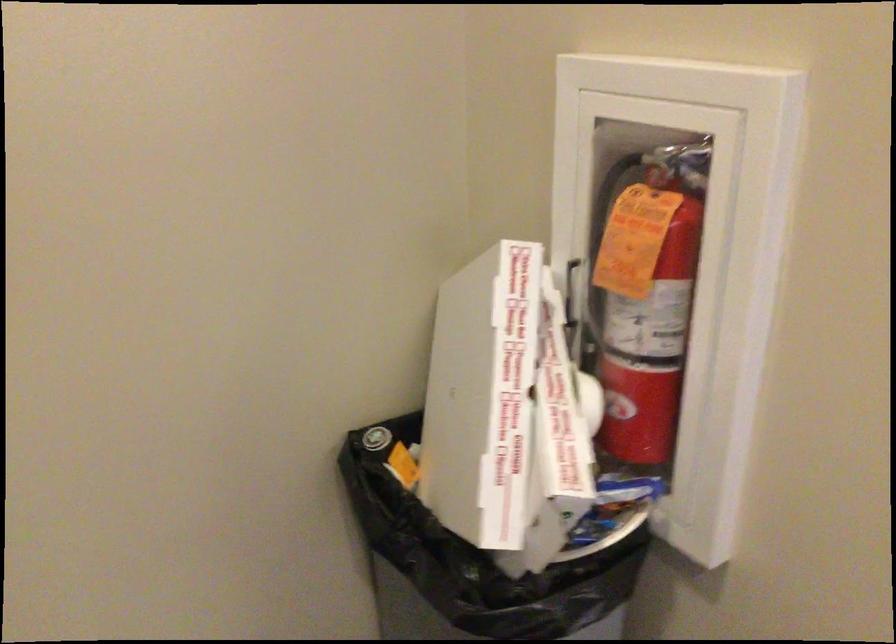
The height and width of the screenshot is (644, 896). What do you see at coordinates (648, 303) in the screenshot?
I see `a fire extinguisher handle` at bounding box center [648, 303].